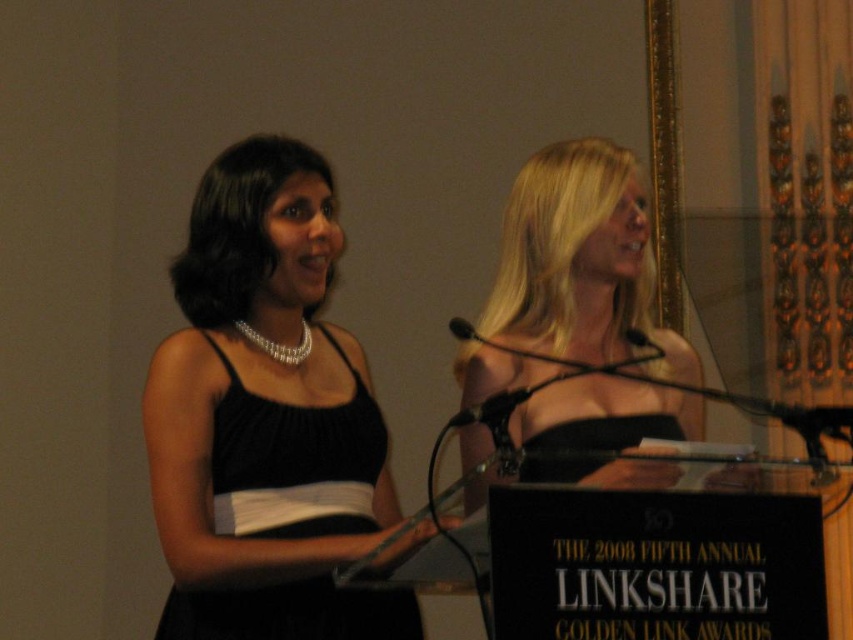
You are a photographer at the awards ceremony. You need to capture a clear photo of the presenter holding the microphone. Which microphone is lower in position between the black plastic microphone at center and the black matte microphone at center?

The black plastic microphone at center is positioned under the black matte microphone at center, so the black plastic microphone at center is lower.